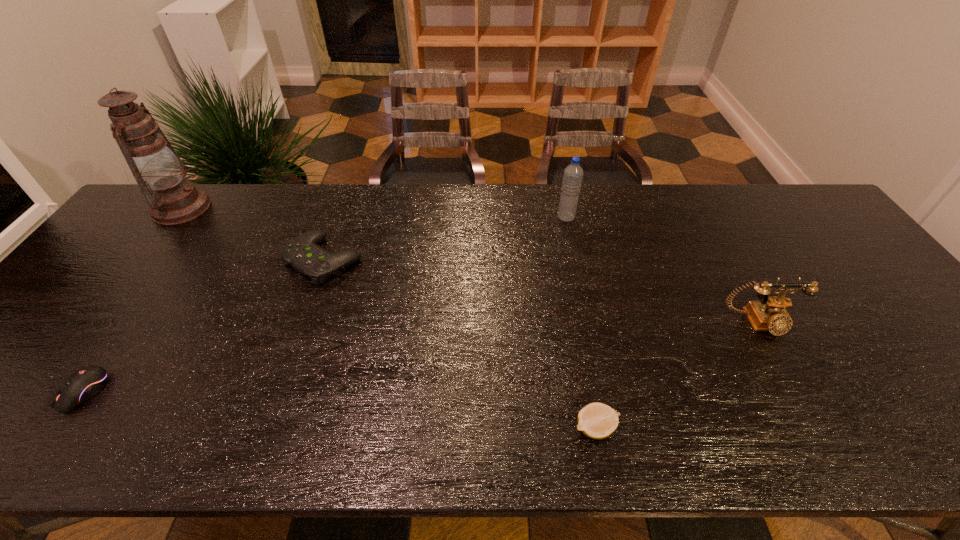
Find the location of a particular element. The height and width of the screenshot is (540, 960). the tallest object is located at coordinates (154, 163).

At what (x,y) coordinates should I click in order to perform the action: click on the second tallest object. Please return your answer as a coordinate pair (x, y). Looking at the image, I should click on (573, 173).

The image size is (960, 540). In order to click on the fourth farthest object in this screenshot , I will do 769,314.

Image resolution: width=960 pixels, height=540 pixels. What are the coordinates of `the fourth shortest object` in the screenshot? It's located at (769, 314).

Find the location of a particular element. control is located at coordinates (303, 253).

Find the location of a particular element. the fourth nearest object is located at coordinates (303, 253).

Locate an element on the screen. This screenshot has width=960, height=540. computer mouse is located at coordinates (85, 383).

Find the location of a particular element. lemon is located at coordinates (596, 420).

Where is `free spot located 0.270m on the front of the tallest object`? free spot located 0.270m on the front of the tallest object is located at coordinates (115, 295).

Identify the location of free space located 0.320m on the left of the water bottle. The image size is (960, 540). (456, 217).